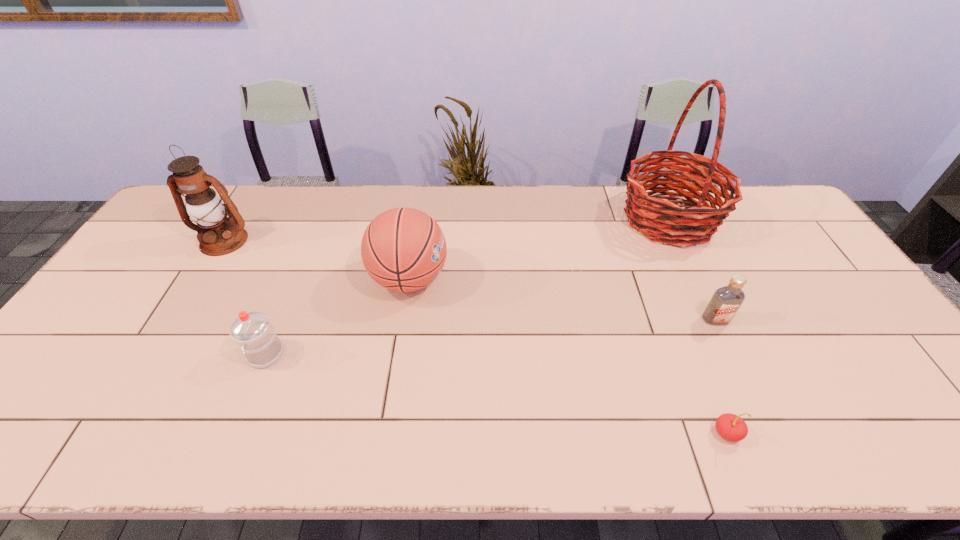
This screenshot has width=960, height=540. Find the location of `the tallest object`. the tallest object is located at coordinates (646, 214).

You are a GUI agent. You are given a task and a screenshot of the screen. Output one action in this format:
    pyautogui.click(x=<x>, y=<y>)
    Task: Click on the leftmost object
    
    Given the screenshot: What is the action you would take?
    pyautogui.click(x=218, y=235)

Where is `lantern`? The width and height of the screenshot is (960, 540). lantern is located at coordinates (218, 235).

Locate an element on the screen. basketball is located at coordinates tap(403, 249).

I want to click on the third object from left to right, so click(403, 249).

This screenshot has height=540, width=960. Find the location of `the fifth object from right to left`. the fifth object from right to left is located at coordinates (253, 332).

Find the location of a particular element. The image size is (960, 540). water bottle is located at coordinates (253, 332).

This screenshot has width=960, height=540. What are the coordinates of `vodka` in the screenshot? It's located at (726, 301).

Image resolution: width=960 pixels, height=540 pixels. I want to click on cherry, so click(x=730, y=427).

Where is `the nearest object`? This screenshot has height=540, width=960. the nearest object is located at coordinates (730, 427).